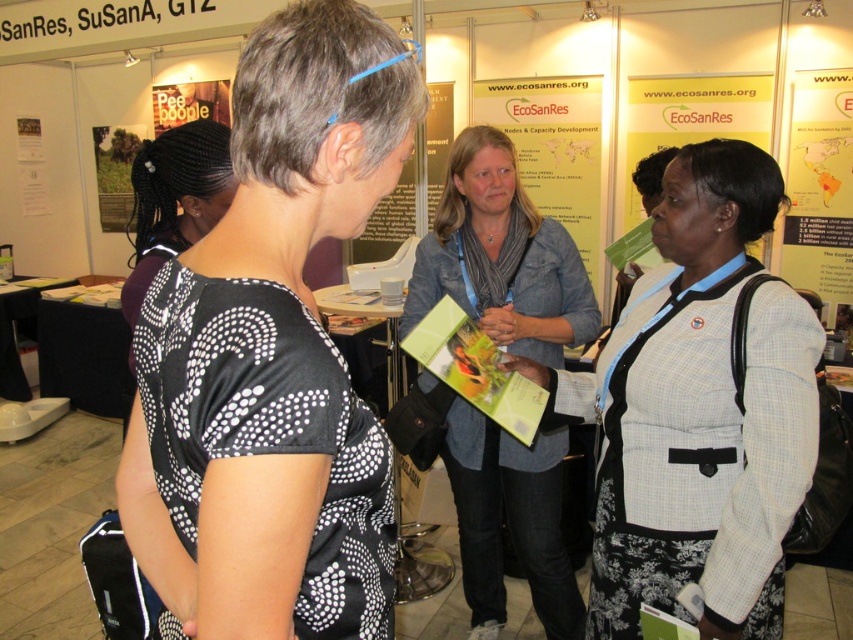
You are standing at the camera position and want to reach a point that is 60 centimeters away. Is the point at coordinate point (265, 348) within your reach?

The point at coordinate point (265, 348) is 63.62 centimeters away from the camera, which is slightly beyond the 60 centimeter reach. Therefore, you cannot reach it.

You are a photographer at the event and need to capture a photo where both the black dotted fabric shirt at center and the denim jacket at center are visible. Based on their heights, which one might you position closer to the front to ensure both are fully visible in the frame?

The black dotted fabric shirt at center has a lesser height compared to the denim jacket at center, so positioning the black dotted fabric shirt at center closer to the front would ensure both are fully visible in the frame.

You are a photographer trying to capture a closeup of the matte green paper at center without including the black dotted fabric shirt at center in the frame. Based on their positions, is this possible?

The black dotted fabric shirt at center is positioned on the left side of matte green paper at center, so if you position yourself to the right side of the matte green paper at center, you can capture the closeup without including the black dotted fabric shirt at center in the frame.